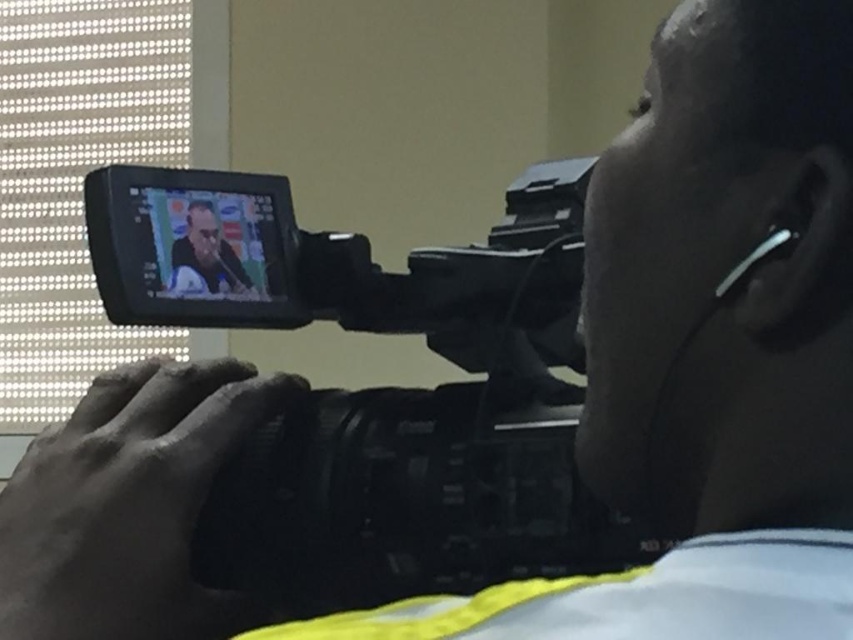
You are a camera operator in the studio. You need to adjust the focus of the camera so that the point at point (343,243) and point (198,230) are both in focus. Which point should you focus on first to ensure both are sharp?

You should focus on point (343,243) first because it is closer to the viewer than point (198,230). By focusing on the closer point, the depth of field will naturally include the farther point in the background.

You are setting up a photography studio and need to place the black plastic camera at center and the matte black laptop at center in a way that follows the studio layout. According to the scene, which object is positioned to the right side?

The black plastic camera at center is positioned to the right of the matte black laptop at center, so the black plastic camera at center is on the right side.

You are setting up a photography studio and need to place the black plastic camera at center and the matte black laptop at center on a shelf. The shelf has a width of 1 meter. Can both items fit side by side without overlapping?

The black plastic camera at center might be wider than the matte black laptop at center, so there is a possibility that they cannot fit side by side on a 1 meter shelf without overlapping. Check their exact widths before placing them.